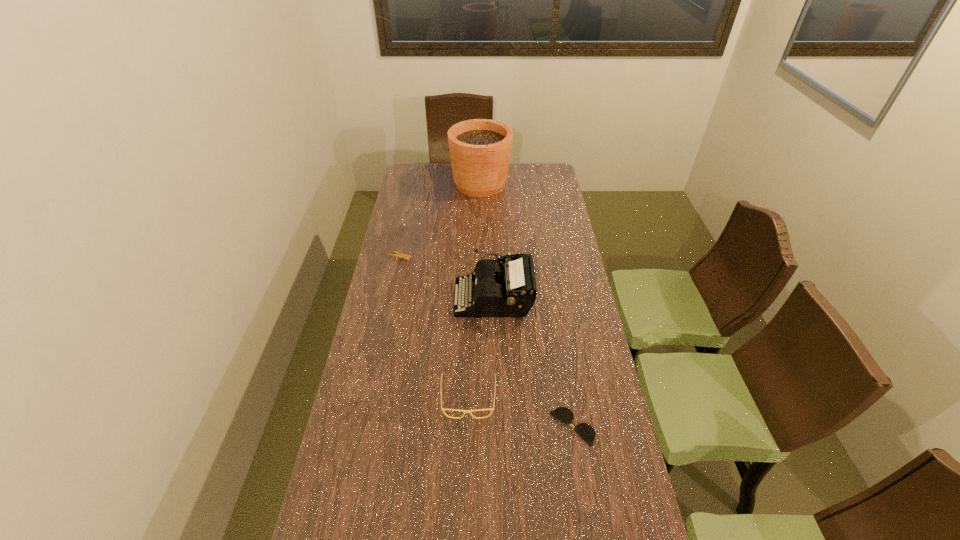
Locate an element on the screen. Image resolution: width=960 pixels, height=540 pixels. free space that satisfies the following two spatial constraints: 1. in front of the lenses of the rightmost object; 2. on the right side of the left spectacles is located at coordinates (468, 427).

This screenshot has height=540, width=960. I want to click on vacant position in the image that satisfies the following two spatial constraints: 1. on the front side of the shorter spectacles; 2. on the right side of the tallest object, so [x=481, y=427].